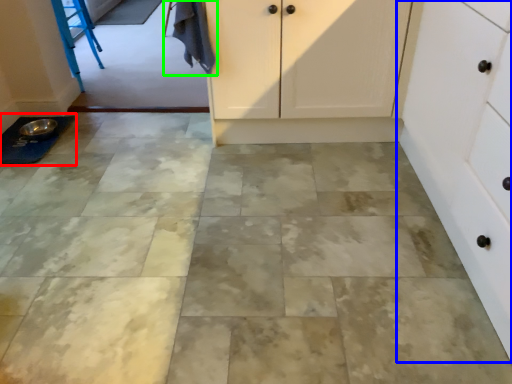
Question: Which object is the closest to the sink (highlighted by a red box)? Choose among these: cabinetry (highlighted by a blue box) or laundry (highlighted by a green box).

Choices:
 (A) cabinetry
 (B) laundry

Answer: (B)